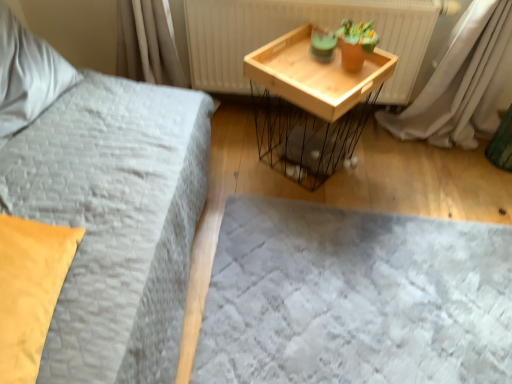
You are a GUI agent. You are given a task and a screenshot of the screen. Output one action in this format:
    pyautogui.click(x=<x>, y=<y>)
    Task: Click on the vacant area located to the right-hand side of wooden tray at center
    
    Given the screenshot: What is the action you would take?
    pyautogui.click(x=393, y=173)